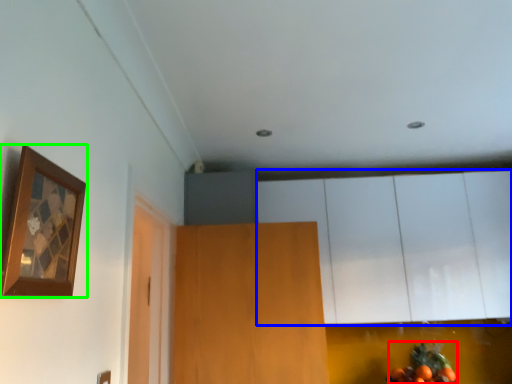
Question: Which object is positioned closest to fruit (highlighted by a red box)? Select from cabinetry (highlighted by a blue box) and picture frame (highlighted by a green box).

Choices:
 (A) cabinetry
 (B) picture frame

Answer: (A)